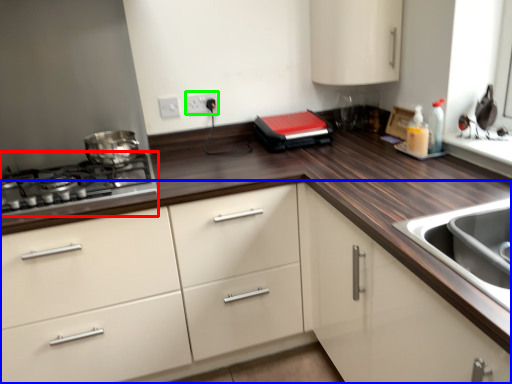
Question: Based on their relative distances, which object is nearer to gas stove (highlighted by a red box)? Choose from cabinetry (highlighted by a blue box) and electric outlet (highlighted by a green box).

Choices:
 (A) cabinetry
 (B) electric outlet

Answer: (A)